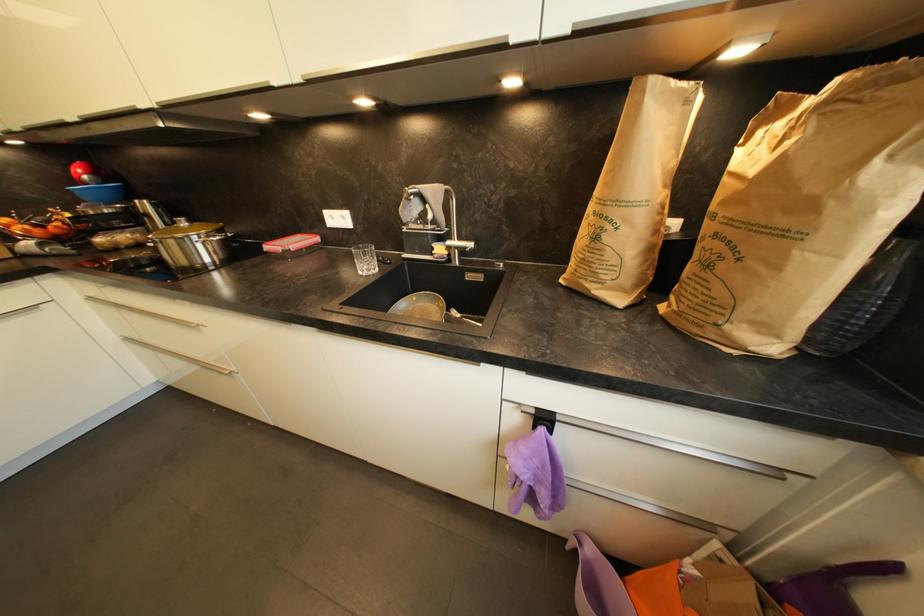
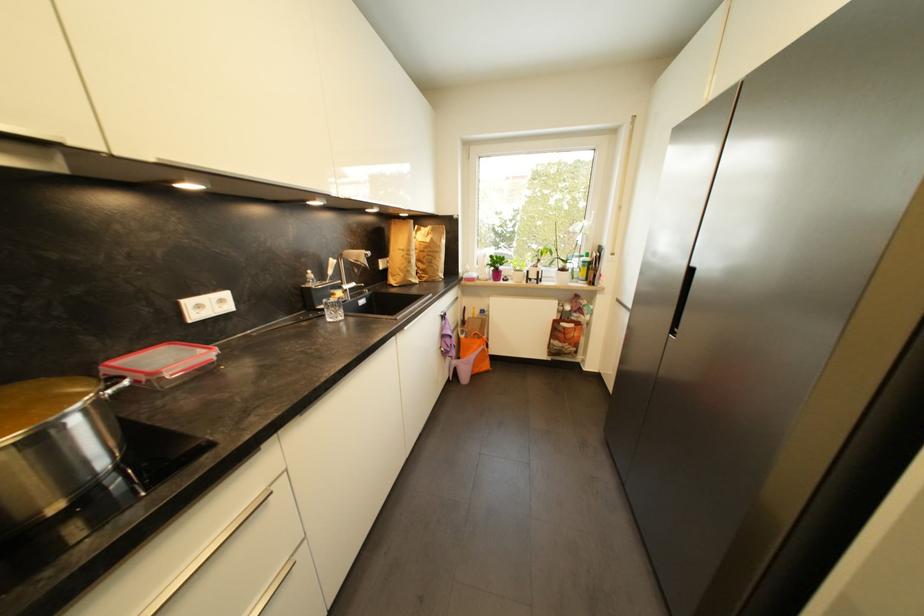
Locate, in the second image, the point that corresponds to point 348,219 in the first image.

(226, 302)